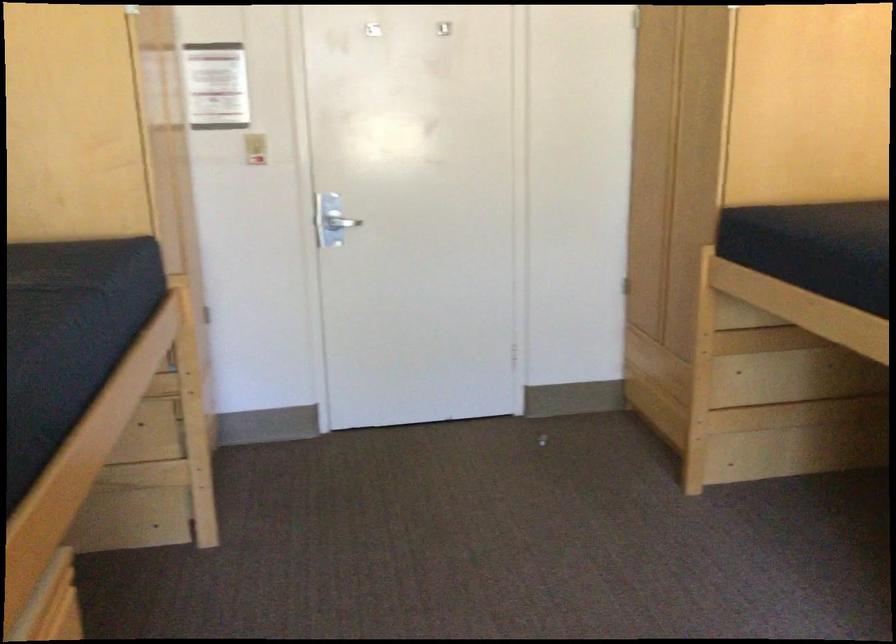
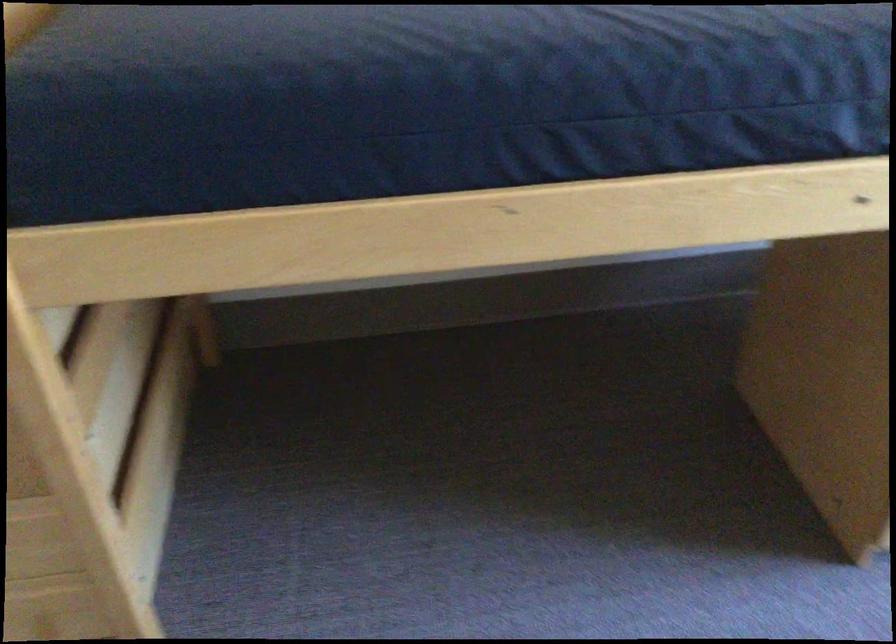
Find the pixel in the second image that matches (791,232) in the first image.

(280, 106)